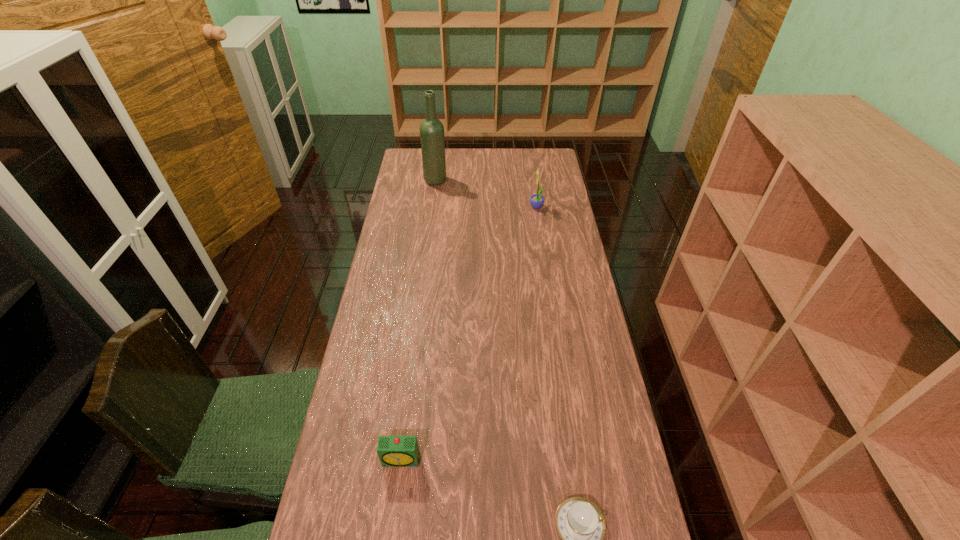
Find the location of a particular element. The height and width of the screenshot is (540, 960). empty space that is in between the third shortest object and the alarm clock is located at coordinates (469, 334).

Find the location of a particular element. This screenshot has height=540, width=960. free space between the third nearest object and the alarm clock is located at coordinates (469, 334).

At what (x,y) coordinates should I click in order to perform the action: click on free spot between the third farthest object and the wine bottle. Please return your answer as a coordinate pair (x, y). Looking at the image, I should click on (419, 320).

The image size is (960, 540). I want to click on free space between the second shortest object and the sunflower, so click(x=469, y=334).

At what (x,y) coordinates should I click in order to perform the action: click on free space between the third tallest object and the farthest object. Please return your answer as a coordinate pair (x, y). Looking at the image, I should click on (419, 320).

In order to click on free point between the second nearest object and the third nearest object in this screenshot , I will do `click(469, 334)`.

Locate an element on the screen. This screenshot has height=540, width=960. empty space between the alarm clock and the farthest object is located at coordinates (419, 320).

The width and height of the screenshot is (960, 540). In order to click on object that is the second closest one to the teacup in this screenshot , I will do `click(536, 200)`.

This screenshot has height=540, width=960. What are the coordinates of `object that is the second closest one to the teacup` in the screenshot? It's located at (536, 200).

This screenshot has height=540, width=960. Identify the location of vacant space that satisfies the following two spatial constraints: 1. on the front-facing side of the third nearest object; 2. on the front-facing side of the second nearest object. (575, 460).